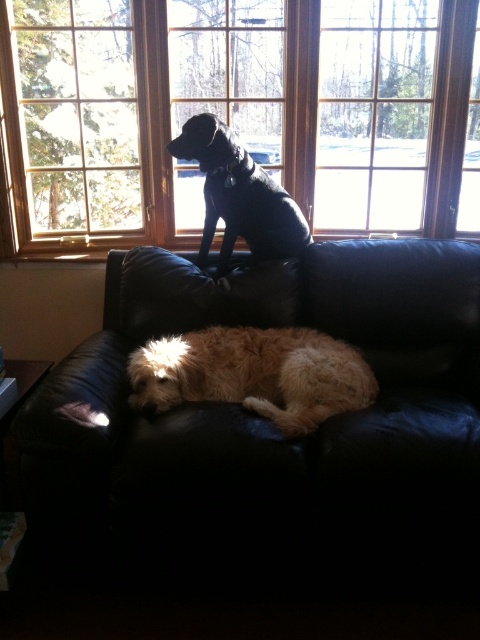
Can you confirm if black leather couch at lower center is bigger than wooden frame at upper center?

No.

Does black leather couch at lower center appear over wooden frame at upper center?

→ No.

Does point (228, 573) come farther from viewer compared to point (26, 93)?

No, it is not.

Locate an element on the screen. black leather couch at lower center is located at coordinates (273, 429).

Between wooden frame at upper center and shiny black dog at upper center, which one appears on the right side from the viewer's perspective?

wooden frame at upper center is more to the right.

Find the location of a particular element. The width and height of the screenshot is (480, 640). wooden frame at upper center is located at coordinates (236, 115).

Locate an element on the screen. wooden frame at upper center is located at coordinates (236, 115).

Based on the photo, can you confirm if fuzzy golden dog at lower center is smaller than shiny black dog at upper center?

No.

Between fuzzy golden dog at lower center and shiny black dog at upper center, which one appears on the left side from the viewer's perspective?

shiny black dog at upper center

Measure the distance between point (276, 330) and camera.

Point (276, 330) and camera are 7.44 feet apart.

The height and width of the screenshot is (640, 480). I want to click on fuzzy golden dog at lower center, so click(x=253, y=372).